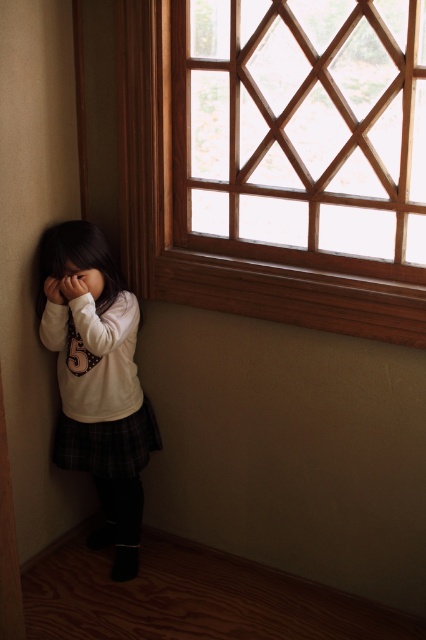
Question: Which point appears closest to the camera in this image?

Choices:
 (A) (97, 294)
 (B) (58, 454)

Answer: (A)

Question: Which is farther from the matte white face at lower left?

Choices:
 (A) wooden lattice at upper right
 (B) white matte shirt at lower left

Answer: (A)

Question: Is white matte shirt at lower left to the left of matte white face at lower left from the viewer's perspective?

Choices:
 (A) no
 (B) yes

Answer: (A)

Question: Does wooden lattice at upper right come in front of white matte shirt at lower left?

Choices:
 (A) yes
 (B) no

Answer: (A)

Question: Which point is closer to the camera?

Choices:
 (A) (296, 125)
 (B) (140, 493)

Answer: (B)

Question: Is wooden lattice at upper right bigger than matte white face at lower left?

Choices:
 (A) yes
 (B) no

Answer: (A)